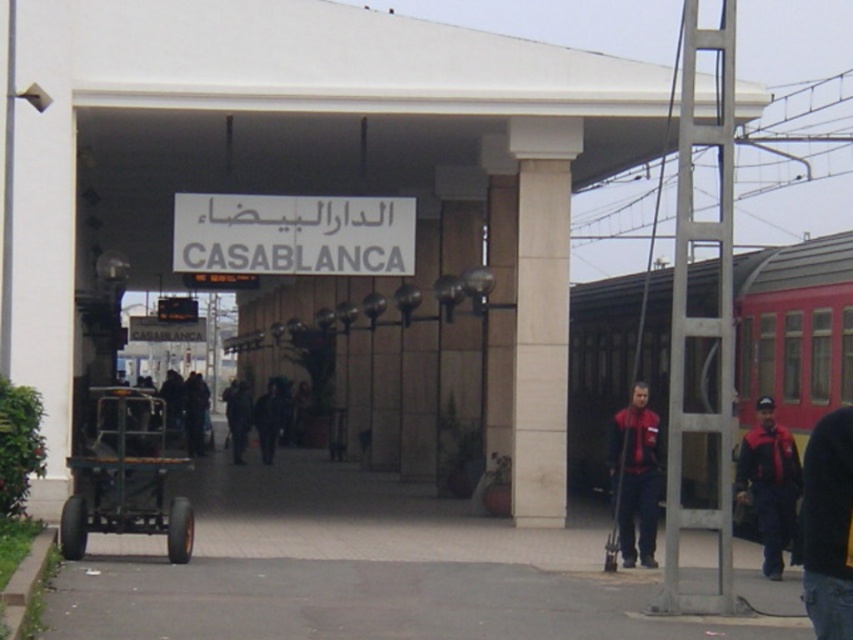
Question: Is metallic black cart at left to the left of dark fabric jacket at center from the viewer's perspective?

Choices:
 (A) no
 (B) yes

Answer: (B)

Question: Can you confirm if red fabric jacket at center is bigger than dark fabric jacket at center?

Choices:
 (A) yes
 (B) no

Answer: (B)

Question: Considering the real-world distances, which object is farthest from the dark clothing at center?

Choices:
 (A) dark fabric jacket at center
 (B) metallic black cart at left
 (C) red fabric jacket at center
 (D) red jacket at right

Answer: (D)

Question: Does metallic black cart at left have a lesser width compared to red jacket at right?

Choices:
 (A) no
 (B) yes

Answer: (A)

Question: Which of these objects is positioned farthest from the red jacket at right?

Choices:
 (A) red fabric jacket at center
 (B) dark fabric jacket at center
 (C) metallic black cart at left
 (D) dark clothing at center

Answer: (D)

Question: Which object appears farthest from the camera in this image?

Choices:
 (A) red fabric jacket at center
 (B) red jacket at right
 (C) metallic black cart at left
 (D) dark fabric jacket at center

Answer: (D)